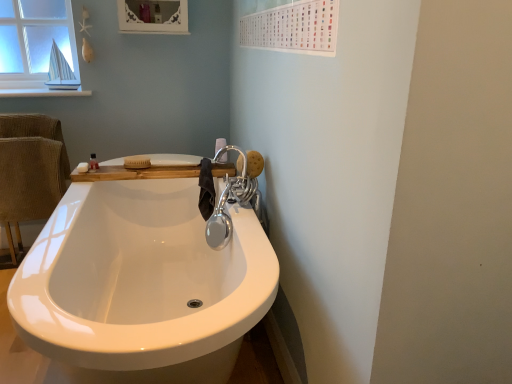
Question: From the image's perspective, would you say woodenmaterial/texturecounter top at upper center is positioned over white matte soap at upper left?

Choices:
 (A) no
 (B) yes

Answer: (A)

Question: Is woodenmaterial/texturecounter top at upper center positioned in front of white matte soap at upper left?

Choices:
 (A) yes
 (B) no

Answer: (A)

Question: Considering the relative sizes of woodenmaterial/texturecounter top at upper center and white matte soap at upper left in the image provided, is woodenmaterial/texturecounter top at upper center smaller than white matte soap at upper left?

Choices:
 (A) yes
 (B) no

Answer: (B)

Question: From a real-world perspective, is woodenmaterial/texturecounter top at upper center positioned over white matte soap at upper left based on gravity?

Choices:
 (A) yes
 (B) no

Answer: (B)

Question: Considering the relative sizes of woodenmaterial/texturecounter top at upper center and white matte soap at upper left in the image provided, is woodenmaterial/texturecounter top at upper center thinner than white matte soap at upper left?

Choices:
 (A) yes
 (B) no

Answer: (B)

Question: From the image's perspective, is woodenmaterial/texturecounter top at upper center under white matte soap at upper left?

Choices:
 (A) yes
 (B) no

Answer: (A)

Question: Is beige corduroy armchair at left at the left side of white matte soap at upper left?

Choices:
 (A) no
 (B) yes

Answer: (B)

Question: Is the depth of beige corduroy armchair at left less than that of white matte soap at upper left?

Choices:
 (A) no
 (B) yes

Answer: (A)

Question: From the image's perspective, is beige corduroy armchair at left located above white matte soap at upper left?

Choices:
 (A) no
 (B) yes

Answer: (A)

Question: Is beige corduroy armchair at left next to white matte soap at upper left and touching it?

Choices:
 (A) yes
 (B) no

Answer: (B)

Question: From the image's perspective, would you say beige corduroy armchair at left is shown under white matte soap at upper left?

Choices:
 (A) yes
 (B) no

Answer: (A)

Question: Does beige corduroy armchair at left have a lesser height compared to white matte soap at upper left?

Choices:
 (A) yes
 (B) no

Answer: (B)

Question: Can you confirm if shiny metallic faucet at upper right is thinner than white matte soap at upper left?

Choices:
 (A) yes
 (B) no

Answer: (B)